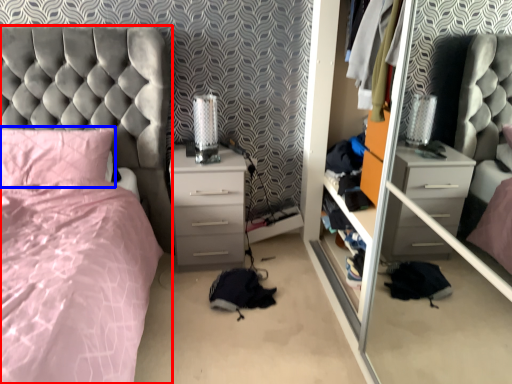
Question: Which object is closer to the camera taking this photo, bed (highlighted by a red box) or pillow (highlighted by a blue box)?

Choices:
 (A) bed
 (B) pillow

Answer: (A)